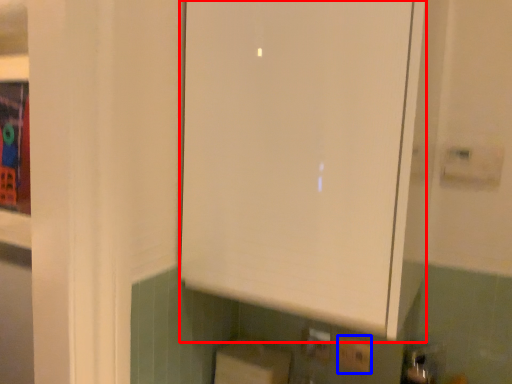
Question: Which object appears closest to the camera in this image, cabinetry (highlighted by a red box) or electric outlet (highlighted by a blue box)?

Choices:
 (A) cabinetry
 (B) electric outlet

Answer: (A)